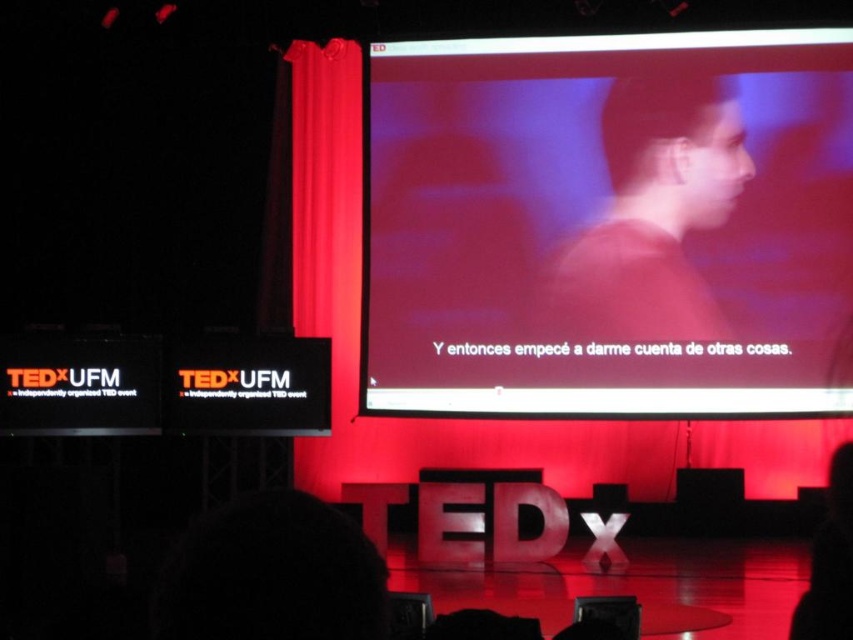
Can you confirm if matte red shirt at center is positioned below dark hair at lower left?

No.

Is matte red shirt at center smaller than dark hair at lower left?

Incorrect, matte red shirt at center is not smaller in size than dark hair at lower left.

I want to click on matte red shirt at center, so click(650, 218).

Locate an element on the screen. The height and width of the screenshot is (640, 853). matte red shirt at center is located at coordinates (650, 218).

Who is more forward, (642,417) or (299,547)?

Positioned in front is point (299,547).

Is point (401, 323) positioned before point (340, 580)?

No, (401, 323) is behind (340, 580).

Between point (735, 208) and point (212, 509), which one is positioned behind?

Point (735, 208)

This screenshot has width=853, height=640. Find the location of `matte screen at center`. matte screen at center is located at coordinates (611, 225).

Is matte screen at center smaller than matte red shirt at center?

No, matte screen at center is not smaller than matte red shirt at center.

Can you confirm if matte screen at center is thinner than matte red shirt at center?

In fact, matte screen at center might be wider than matte red shirt at center.

Who is more distant from viewer, (370, 108) or (553, 266)?

Point (370, 108)

Where is `matte screen at center`? matte screen at center is located at coordinates (611, 225).